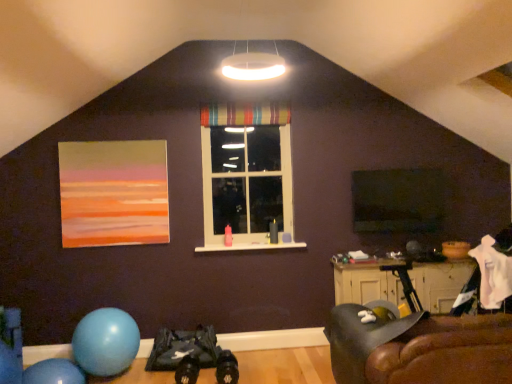
Question: In terms of size, does striped fabric curtain at upper center appear bigger or smaller than wooden cabinet at lower right?

Choices:
 (A) small
 (B) big

Answer: (A)

Question: From the image's perspective, is striped fabric curtain at upper center located above or below wooden cabinet at lower right?

Choices:
 (A) above
 (B) below

Answer: (A)

Question: Which is nearer to the leather couch at lower right?

Choices:
 (A) matte acrylic painting at upper left
 (B) wooden cabinet at lower right
 (C) blue rubber balloon at lower left
 (D) transparent plastic window screen at center
 (E) striped fabric window at center

Answer: (B)

Question: Based on their relative distances, which object is nearer to the striped fabric window at center?

Choices:
 (A) wooden cabinet at lower right
 (B) blue rubber balloon at lower left
 (C) matte acrylic painting at upper left
 (D) transparent plastic window screen at center
 (E) leather couch at lower right

Answer: (C)